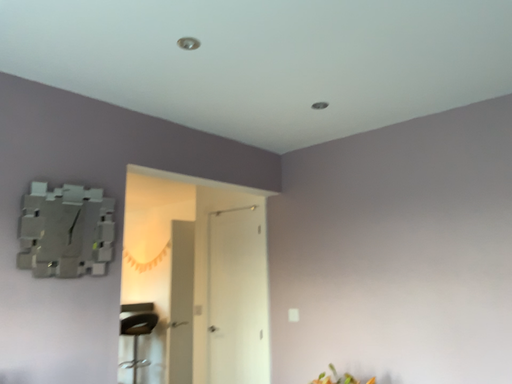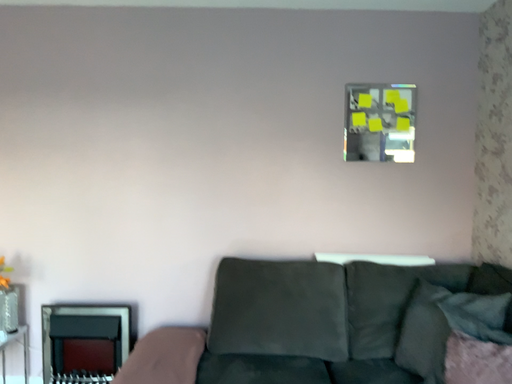
Question: Which way did the camera rotate in the video?

Choices:
 (A) rotated left
 (B) rotated right

Answer: (B)